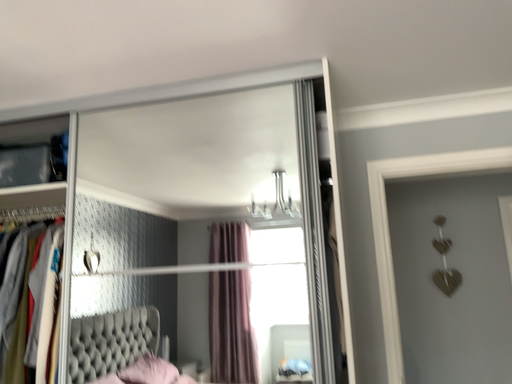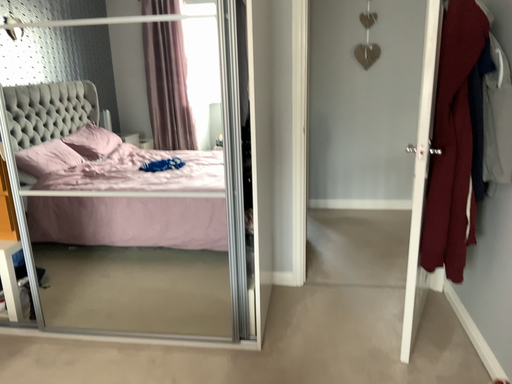
Question: Which way did the camera rotate in the video?

Choices:
 (A) rotated downward
 (B) rotated upward

Answer: (A)